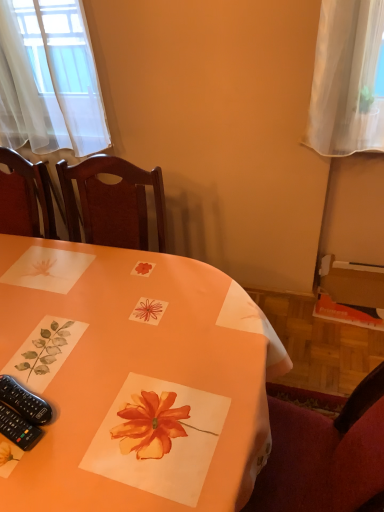
Question: Is orange paper placemat at center closer to camera compared to black plastic remote control at lower left, positioned as the second remote control in top-to-bottom order?

Choices:
 (A) no
 (B) yes

Answer: (B)

Question: From the image's perspective, is orange paper placemat at center over black plastic remote control at lower left, the first remote control positioned from the bottom?

Choices:
 (A) no
 (B) yes

Answer: (A)

Question: Does orange paper placemat at center have a larger size compared to black plastic remote control at lower left, positioned as the second remote control in top-to-bottom order?

Choices:
 (A) no
 (B) yes

Answer: (B)

Question: Is orange paper placemat at center smaller than black plastic remote control at lower left, the first remote control positioned from the bottom?

Choices:
 (A) no
 (B) yes

Answer: (A)

Question: Is orange paper placemat at center not inside black plastic remote control at lower left, the first remote control positioned from the bottom?

Choices:
 (A) no
 (B) yes

Answer: (B)

Question: Considering the relative sizes of orange paper placemat at center and black plastic remote control at lower left, the first remote control positioned from the bottom, in the image provided, is orange paper placemat at center taller than black plastic remote control at lower left, the first remote control positioned from the bottom,?

Choices:
 (A) yes
 (B) no

Answer: (A)

Question: Is black plastic remote control at lower left, which is counted as the first remote control, starting from the top, at the left side of orange paper placemat at center?

Choices:
 (A) no
 (B) yes

Answer: (A)

Question: Is black plastic remote control at lower left, positioned as the 2th remote control in bottom-to-top order, not inside orange paper placemat at center?

Choices:
 (A) yes
 (B) no

Answer: (B)

Question: Is black plastic remote control at lower left, positioned as the 2th remote control in bottom-to-top order, facing towards orange paper placemat at center?

Choices:
 (A) no
 (B) yes

Answer: (B)

Question: Is black plastic remote control at lower left, which is counted as the first remote control, starting from the top, positioned far away from orange paper placemat at center?

Choices:
 (A) yes
 (B) no

Answer: (B)

Question: From a real-world perspective, is black plastic remote control at lower left, which is counted as the first remote control, starting from the top, positioned under orange paper placemat at center based on gravity?

Choices:
 (A) yes
 (B) no

Answer: (B)

Question: Is the surface of black plastic remote control at lower left, positioned as the 2th remote control in bottom-to-top order, in direct contact with orange paper placemat at center?

Choices:
 (A) no
 (B) yes

Answer: (A)

Question: Is black plastic remote control at lower left, which is counted as the first remote control, starting from the top, outside of black plastic remote control at lower left, the first remote control positioned from the bottom?

Choices:
 (A) no
 (B) yes

Answer: (B)